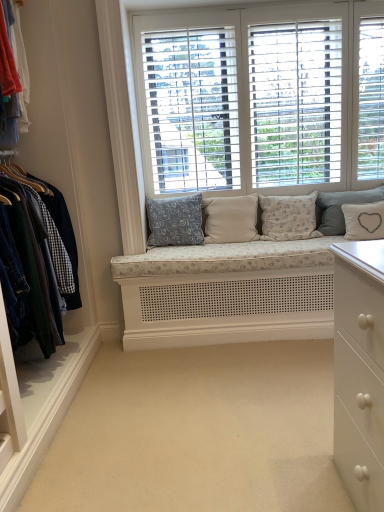
Question: Should I look upward or downward to see blue floral fabric pillow at center, the 1th pillow viewed from the left?

Choices:
 (A) up
 (B) down

Answer: (A)

Question: Is white wood window at center facing towards denim jacket at left?

Choices:
 (A) yes
 (B) no

Answer: (B)

Question: From the image's perspective, is white wood window at center below denim jacket at left?

Choices:
 (A) yes
 (B) no

Answer: (B)

Question: Considering the relative positions of white wood window at center and denim jacket at left in the image provided, is white wood window at center in front of denim jacket at left?

Choices:
 (A) yes
 (B) no

Answer: (B)

Question: Is white wood window at center further to the viewer compared to denim jacket at left?

Choices:
 (A) yes
 (B) no

Answer: (A)

Question: Would you say white wood window at center contains denim jacket at left?

Choices:
 (A) yes
 (B) no

Answer: (B)

Question: Can you confirm if white wood window at center is wider than denim jacket at left?

Choices:
 (A) no
 (B) yes

Answer: (A)

Question: Is white wood window at center outside beige carpet at center?

Choices:
 (A) no
 (B) yes

Answer: (B)

Question: From a real-world perspective, is white wood window at center on beige carpet at center?

Choices:
 (A) yes
 (B) no

Answer: (A)

Question: From the image's perspective, does white wood window at center appear higher than beige carpet at center?

Choices:
 (A) yes
 (B) no

Answer: (A)

Question: Is white wood window at center at the right side of beige carpet at center?

Choices:
 (A) yes
 (B) no

Answer: (A)

Question: Considering the relative positions of white wood window at center and beige carpet at center in the image provided, is white wood window at center behind beige carpet at center?

Choices:
 (A) no
 (B) yes

Answer: (B)

Question: Is white wood window at center oriented away from beige carpet at center?

Choices:
 (A) no
 (B) yes

Answer: (A)

Question: Is denim jacket at left far from white fabric pillow with heart design at center, which ranks as the 1th pillow in right-to-left order?

Choices:
 (A) yes
 (B) no

Answer: (A)